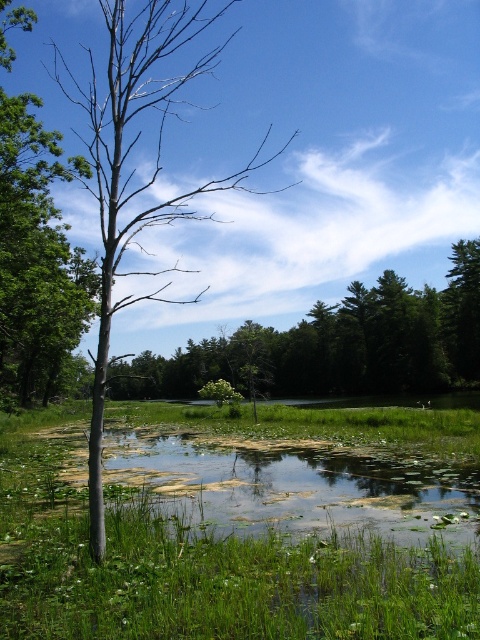
Question: Can you confirm if smooth bark tree at center is positioned below bare wood tree at left?

Choices:
 (A) yes
 (B) no

Answer: (A)

Question: Does green algae water at center appear over smooth bark tree at center?

Choices:
 (A) no
 (B) yes

Answer: (B)

Question: Which object is farther from the camera taking this photo?

Choices:
 (A) bare wood tree at left
 (B) green algae water at center

Answer: (B)

Question: Which object is farther from the camera taking this photo?

Choices:
 (A) green leafy grass at center
 (B) bare wood tree at left

Answer: (B)

Question: Which point is farther from the camera taking this photo?

Choices:
 (A) (184, 612)
 (B) (32, 161)
 (C) (112, 227)
 (D) (479, 368)

Answer: (D)

Question: Is green algae water at center positioned behind smooth bark tree at center?

Choices:
 (A) yes
 (B) no

Answer: (B)